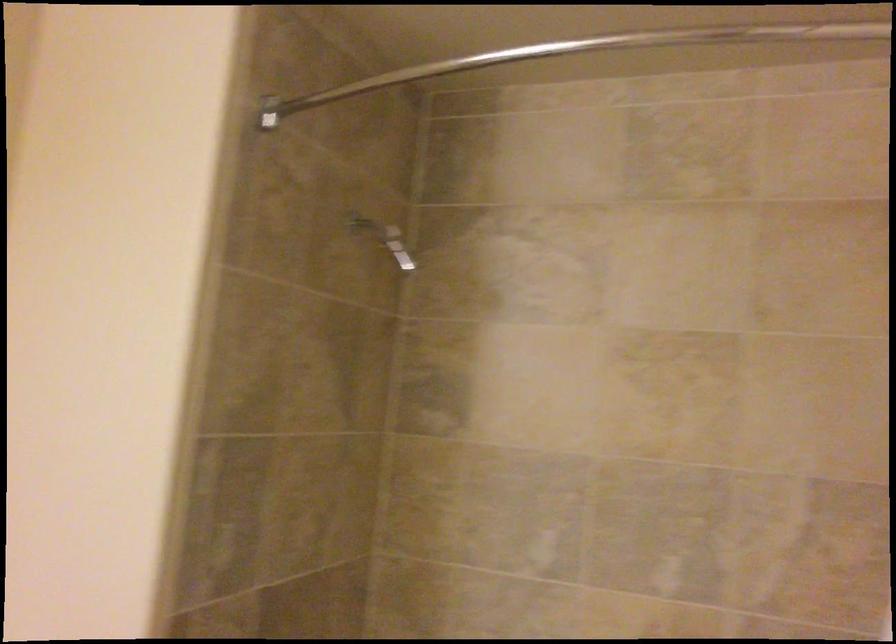
Describe the element at coordinates (414, 77) in the screenshot. I see `a curved metal rod` at that location.